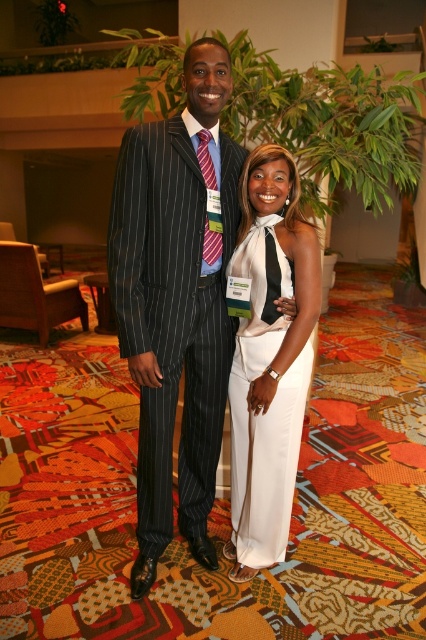
Is pinstriped suit at center positioned before white satin dress at center?

Yes, pinstriped suit at center is in front of white satin dress at center.

Between pinstriped suit at center and white satin dress at center, which one is positioned lower?

Positioned lower is white satin dress at center.

The image size is (426, 640). I want to click on pinstriped suit at center, so click(176, 301).